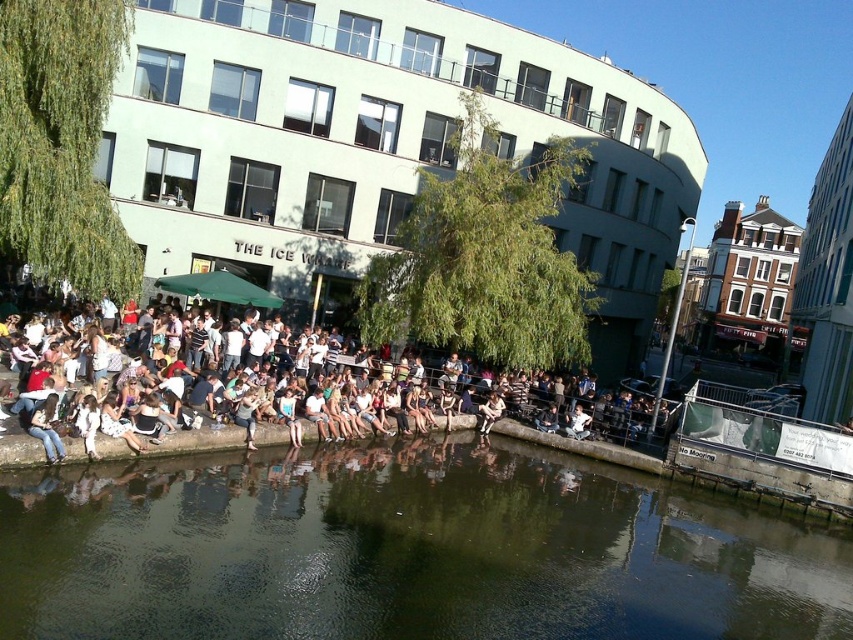
Can you confirm if denim jeans at lower left is thinner than denim jacket at lower center?

Indeed, denim jeans at lower left has a lesser width compared to denim jacket at lower center.

Is denim jeans at lower left to the left of denim jacket at lower center from the viewer's perspective?

Correct, you'll find denim jeans at lower left to the left of denim jacket at lower center.

Who is more distant from viewer, (49,419) or (494,416)?

Positioned behind is point (494,416).

Identify the location of denim jeans at lower left. (47, 428).

Is point (184, 396) positioned after point (494, 397)?

No, (184, 396) is closer to viewer.

Looking at this image, is white casual clothing at center wider than denim jacket at lower center?

Correct, the width of white casual clothing at center exceeds that of denim jacket at lower center.

Find the location of `white casual clothing at center`. white casual clothing at center is located at coordinates (323, 410).

Where is `white casual clothing at center`? The image size is (853, 640). white casual clothing at center is located at coordinates (323, 410).

Is the position of greenish water at lower center more distant than that of denim jeans at lower left?

No.

The width and height of the screenshot is (853, 640). Identify the location of greenish water at lower center. (403, 550).